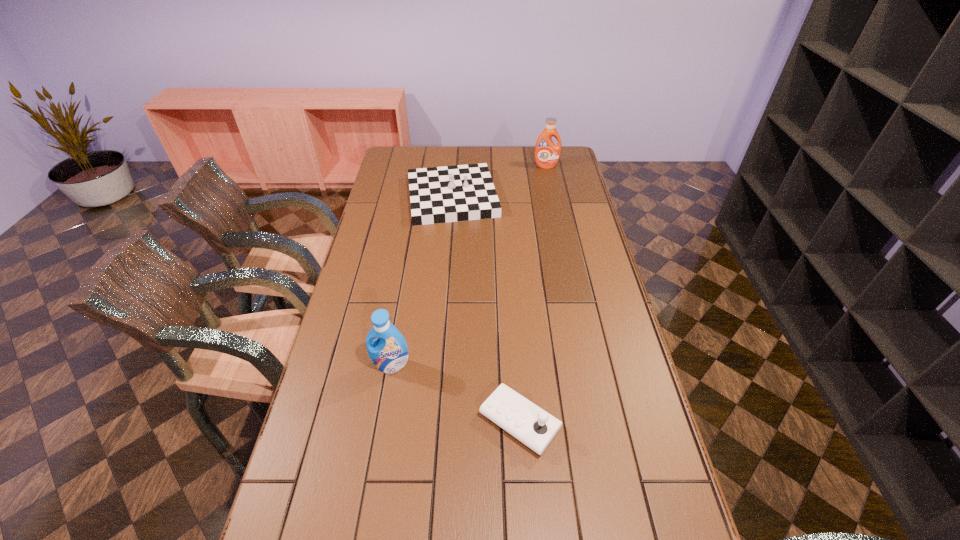
Select which object appears as the third closest to the rightmost object. Please provide its 2D coordinates. Your answer should be formatted as a tuple, i.e. [(x, y)], where the tuple contains the x and y coordinates of a point satisfying the conditions above.

[(531, 425)]

The image size is (960, 540). What are the coordinates of `vacant space that satisfies the following two spatial constraints: 1. on the front side of the second farthest object; 2. on the left side of the shortest object` in the screenshot? It's located at (435, 422).

Where is `vacant space that satisfies the following two spatial constraints: 1. on the front-facing side of the second nearest object; 2. on the left side of the nearest object`? vacant space that satisfies the following two spatial constraints: 1. on the front-facing side of the second nearest object; 2. on the left side of the nearest object is located at coordinates (381, 422).

Where is `free space that satisfies the following two spatial constraints: 1. on the front-facing side of the shortest object; 2. on the left side of the second nearest object`? The height and width of the screenshot is (540, 960). free space that satisfies the following two spatial constraints: 1. on the front-facing side of the shortest object; 2. on the left side of the second nearest object is located at coordinates (381, 422).

This screenshot has height=540, width=960. Find the location of `vacant point that satisfies the following two spatial constraints: 1. on the front-facing side of the left detergent; 2. on the left side of the shortest object`. vacant point that satisfies the following two spatial constraints: 1. on the front-facing side of the left detergent; 2. on the left side of the shortest object is located at coordinates (381, 422).

Find the location of a particular element. The image size is (960, 540). vacant space that satisfies the following two spatial constraints: 1. on the front-facing side of the nearest object; 2. on the left side of the third farthest object is located at coordinates (381, 422).